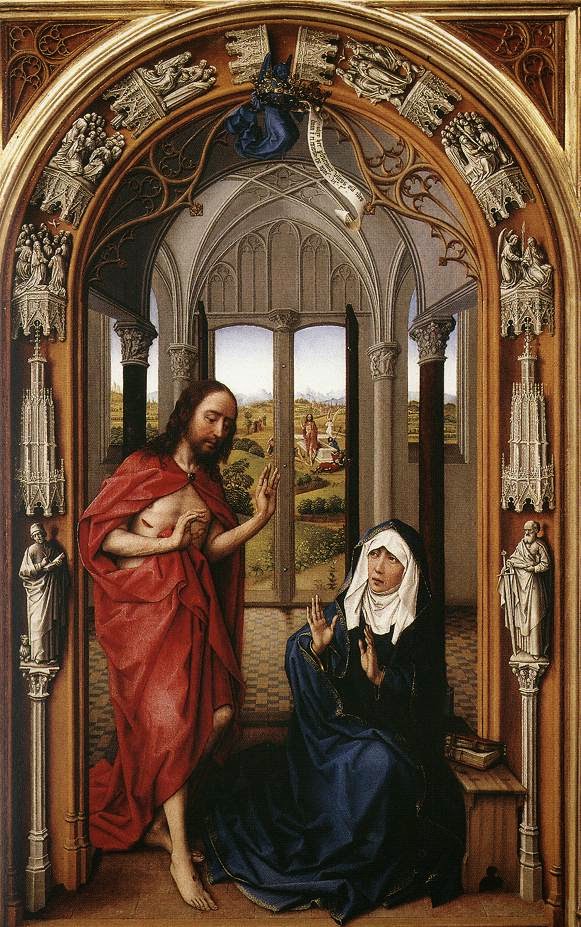
You are a GUI agent. You are given a task and a screenshot of the screen. Output one action in this format:
    pyautogui.click(x=<x>, y=<y>)
    Task: Click on the rectangular religious painting
    Image resolution: width=581 pixels, height=927 pixels.
    Given the screenshot: What is the action you would take?
    pyautogui.click(x=7, y=13)